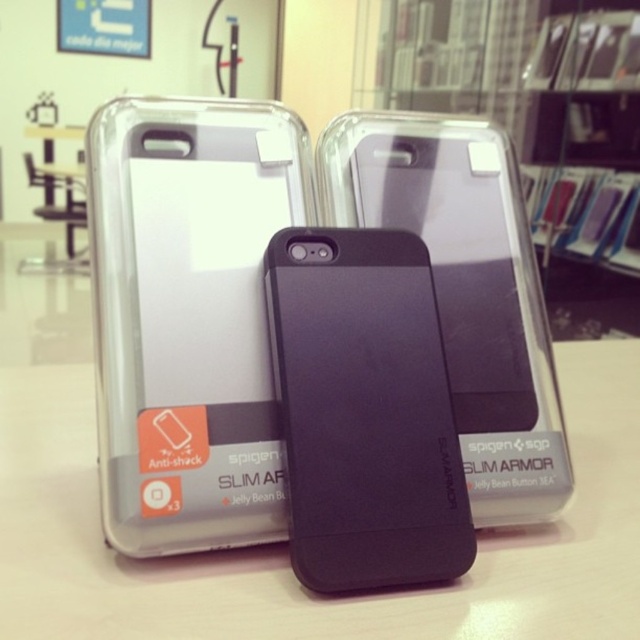
Who is higher up, clear plastic phone case at left or matte black phone at center?

matte black phone at center is above.

Is point (136, 476) more distant than point (534, 296)?

No, it is not.

Image resolution: width=640 pixels, height=640 pixels. In order to click on clear plastic phone case at left in this screenshot , I will do `click(188, 316)`.

Can you confirm if black matte phone case at center is positioned to the left of matte black phone at center?

Yes, black matte phone case at center is to the left of matte black phone at center.

Does point (317, 385) come closer to viewer compared to point (534, 336)?

Yes, it is.

At what (x,y) coordinates should I click in order to perform the action: click on black matte phone case at center. Please return your answer as a coordinate pair (x, y). This screenshot has width=640, height=640. Looking at the image, I should click on (364, 412).

Can you confirm if clear plastic phone case at left is wider than white matte table at center?

No.

In the scene shown: Between clear plastic phone case at left and white matte table at center, which one has less height?

white matte table at center is shorter.

Which is in front, point (257, 276) or point (586, 362)?

Point (257, 276) is more forward.

The image size is (640, 640). I want to click on clear plastic phone case at left, so click(x=188, y=316).